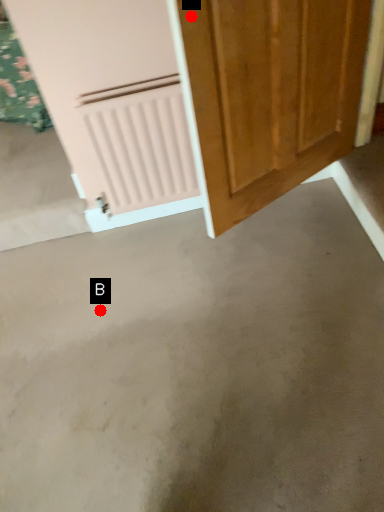
Question: Two points are circled on the image, labeled by A and B beside each circle. Which point appears farthest from the camera in this image?

Choices:
 (A) A is further
 (B) B is further

Answer: (B)